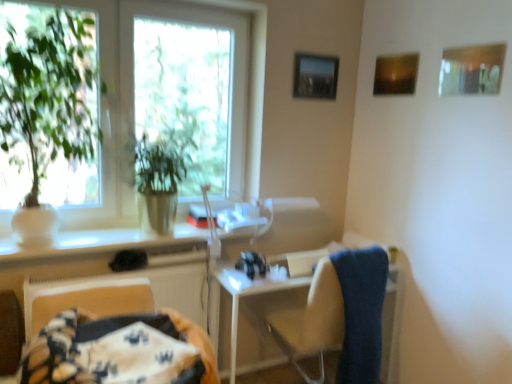
Question: Considering the relative sizes of blue fabric towel at right and green matte plant at left in the image provided, is blue fabric towel at right shorter than green matte plant at left?

Choices:
 (A) yes
 (B) no

Answer: (A)

Question: Would you consider blue fabric towel at right to be distant from green matte plant at left?

Choices:
 (A) yes
 (B) no

Answer: (A)

Question: Is blue fabric towel at right next to green matte plant at left?

Choices:
 (A) no
 (B) yes

Answer: (A)

Question: Is blue fabric towel at right not inside green matte plant at left?

Choices:
 (A) yes
 (B) no

Answer: (A)

Question: Considering the relative sizes of blue fabric towel at right and green matte plant at left in the image provided, is blue fabric towel at right bigger than green matte plant at left?

Choices:
 (A) no
 (B) yes

Answer: (A)

Question: In the image, is white glossy counter top at center positioned in front of or behind metallic silver picture frame at upper center, which appears as the first picture frame when viewed from the back?

Choices:
 (A) front
 (B) behind

Answer: (A)

Question: From a real-world perspective, is white glossy counter top at center positioned above or below metallic silver picture frame at upper center, the 3th picture frame positioned from the right?

Choices:
 (A) below
 (B) above

Answer: (A)

Question: In terms of height, does white glossy counter top at center look taller or shorter compared to metallic silver picture frame at upper center, which is counted as the 1th picture frame, starting from the left?

Choices:
 (A) short
 (B) tall

Answer: (A)

Question: Visually, is white glossy counter top at center positioned to the left or to the right of metallic silver picture frame at upper center, which is the 3th picture frame in front-to-back order?

Choices:
 (A) left
 (B) right

Answer: (A)

Question: Considering the relative positions of green leafy plant at left and white glossy counter top at center in the image provided, is green leafy plant at left to the left or to the right of white glossy counter top at center?

Choices:
 (A) right
 (B) left

Answer: (B)

Question: From the image's perspective, is green leafy plant at left above or below white glossy counter top at center?

Choices:
 (A) above
 (B) below

Answer: (A)

Question: In the image, is green leafy plant at left positioned in front of or behind white glossy counter top at center?

Choices:
 (A) behind
 (B) front

Answer: (A)

Question: In terms of height, does green leafy plant at left look taller or shorter compared to white glossy counter top at center?

Choices:
 (A) tall
 (B) short

Answer: (A)

Question: Is point (115, 64) positioned closer to the camera than point (5, 155)?

Choices:
 (A) closer
 (B) farther

Answer: (B)

Question: Which is correct: green leafy plant at left is inside green matte plant at left, or outside of it?

Choices:
 (A) outside
 (B) inside

Answer: (A)